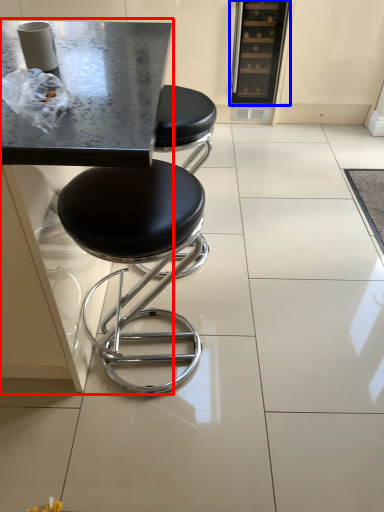
Question: Among these objects, which one is farthest to the camera, round table (highlighted by a red box) or appliance (highlighted by a blue box)?

Choices:
 (A) round table
 (B) appliance

Answer: (B)